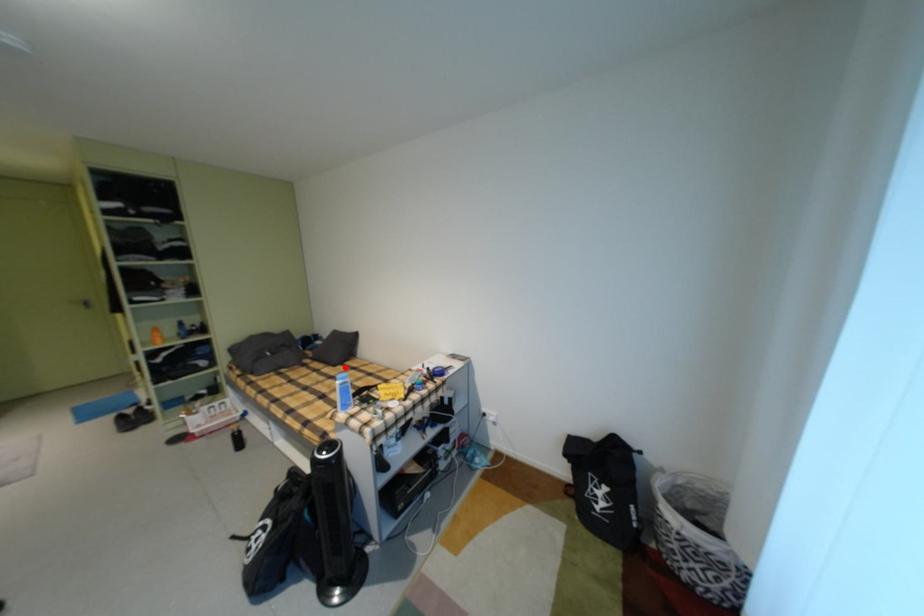
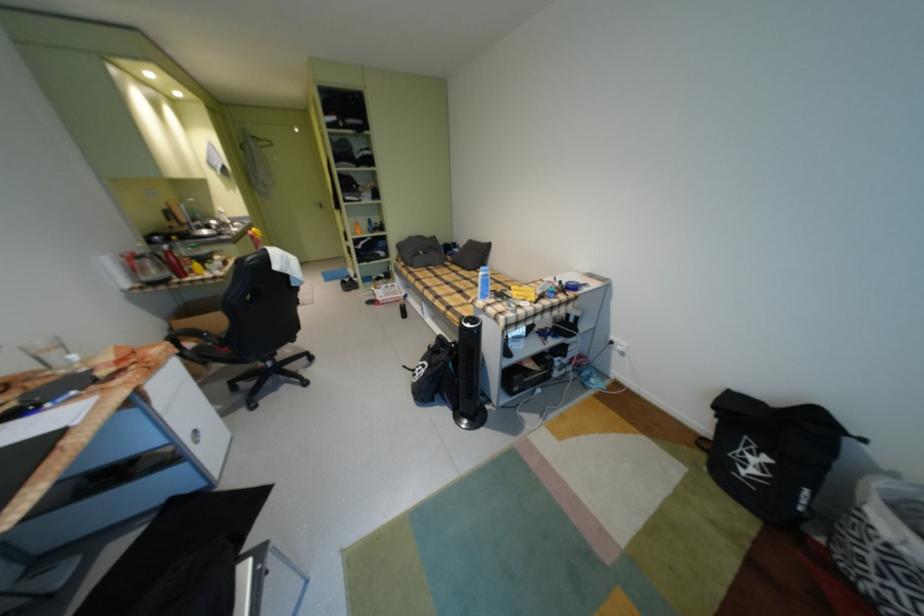
Find the pixel in the second image that matches the highlighted location in the first image.

(479, 272)